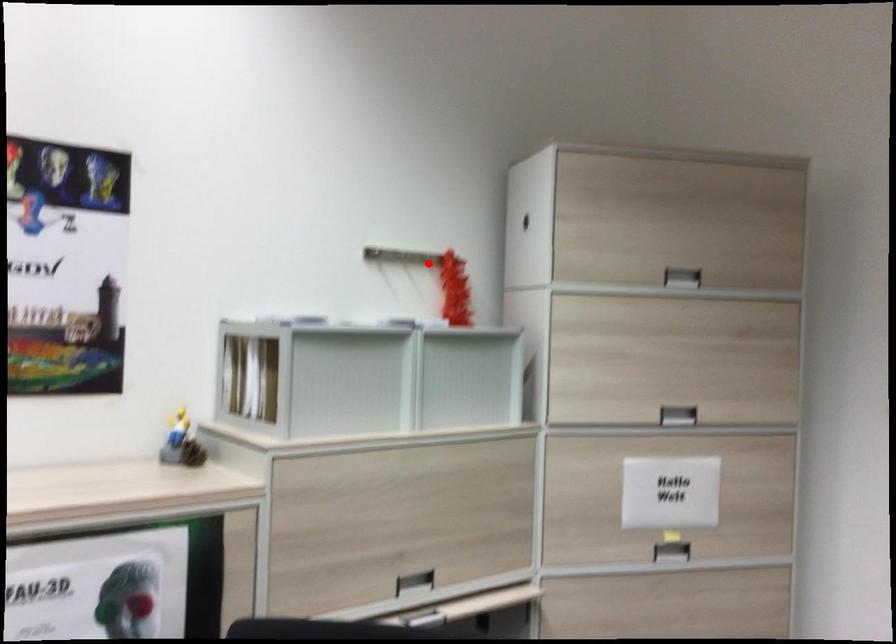
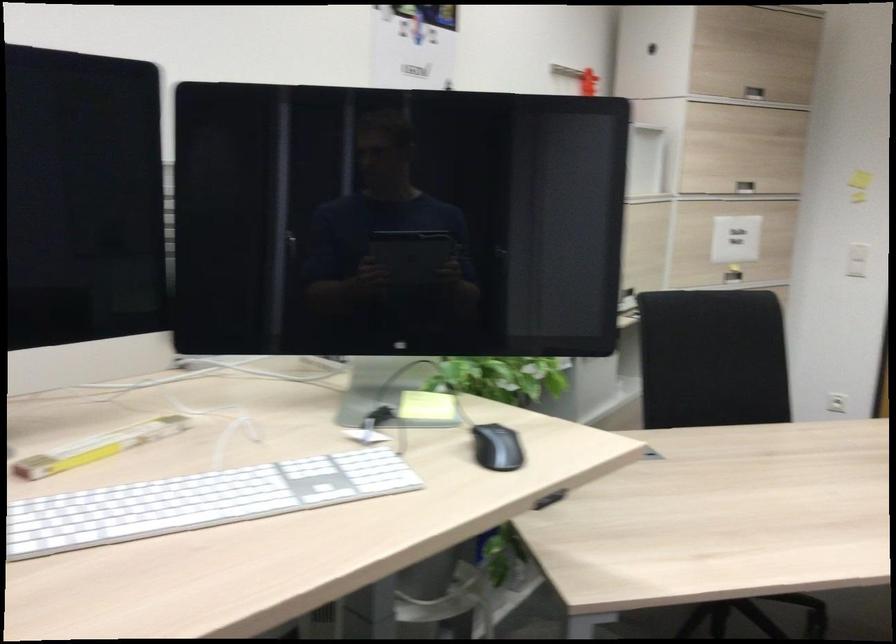
Question: I am providing you with two images of the same scene from different viewpoints. Image1 has a red point marked. In image2, the corresponding 3D location appears at what relative position? Reply with the corresponding letter.

Choices:
 (A) Closer
 (B) Farther

Answer: (B)